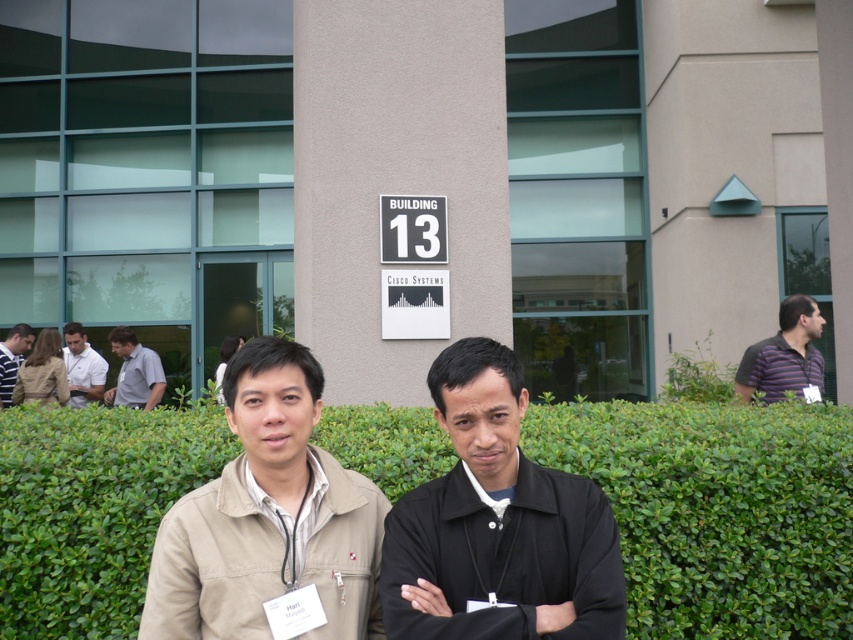
Is point (532, 589) farther from camera compared to point (91, 360)?

No, it is not.

Does black matte jacket at center have a smaller size compared to white shirt at left?

Correct, black matte jacket at center occupies less space than white shirt at left.

The image size is (853, 640). In order to click on black matte jacket at center in this screenshot , I will do `click(497, 524)`.

Can you confirm if light brown shirt at left is positioned above light gray shirt at left?

Indeed, light brown shirt at left is positioned over light gray shirt at left.

Which is behind, point (152, 353) or point (148, 358)?

Point (152, 353)

Locate an element on the screen. This screenshot has width=853, height=640. light brown shirt at left is located at coordinates (109, 371).

Consider the image. Can you confirm if green leafy hedge at center is thinner than beige fabric jacket at center?

No, green leafy hedge at center is not thinner than beige fabric jacket at center.

Is point (80, 552) positioned in front of point (274, 564)?

That is False.

In the scene shown: Who is more distant from viewer, [88,614] or [209,564]?

Positioned behind is point [88,614].

The width and height of the screenshot is (853, 640). In order to click on green leafy hedge at center in this screenshot , I will do `click(718, 509)`.